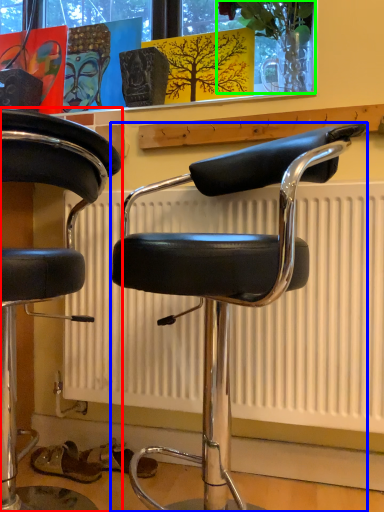
Question: Which object is positioned closest to chair (highlighted by a red box)? Select from chair (highlighted by a blue box) and plant (highlighted by a green box).

Choices:
 (A) chair
 (B) plant

Answer: (A)